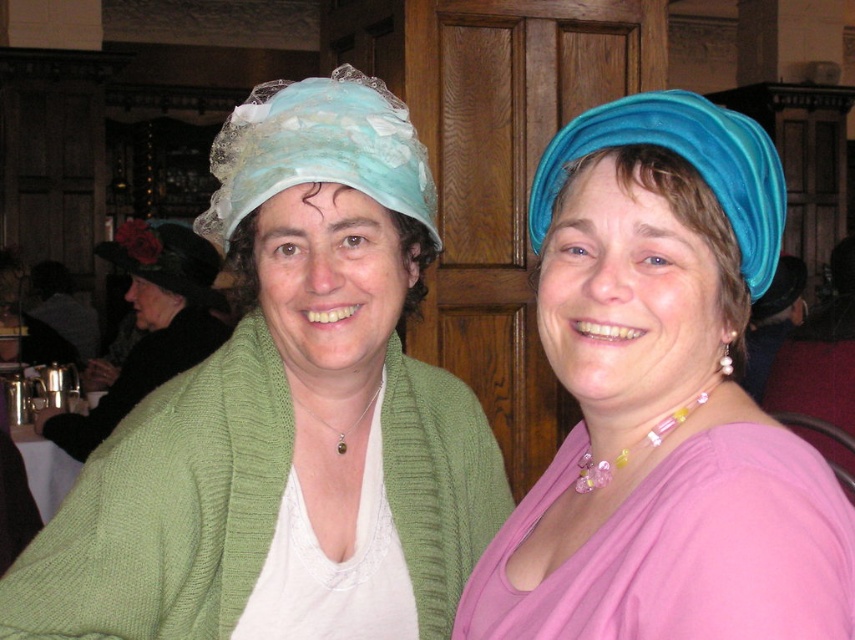
Can you confirm if blue velvet hat at upper right is smaller than blue velvet headscarf at upper right?

No.

Does blue velvet hat at upper right lie in front of blue velvet headscarf at upper right?

That is True.

Is point (800, 525) farther from camera compared to point (758, 256)?

No.

Where is `blue velvet hat at upper right`? blue velvet hat at upper right is located at coordinates (662, 401).

Can you confirm if blue velvet hat at upper right is wider than green knitted robe at center?

No.

Does point (730, 621) come in front of point (422, 417)?

Yes, it is in front of point (422, 417).

Locate an element on the screen. The height and width of the screenshot is (640, 855). blue velvet hat at upper right is located at coordinates (662, 401).

You are a GUI agent. You are given a task and a screenshot of the screen. Output one action in this format:
    pyautogui.click(x=<x>, y=<y>)
    Task: Click on the blue velvet hat at upper right
    The width and height of the screenshot is (855, 640).
    Given the screenshot: What is the action you would take?
    pos(662,401)

Which is in front, point (254, 406) or point (603, 540)?

Point (603, 540) is more forward.

Does green knitted robe at center appear over pink satin robe at center?

Correct, green knitted robe at center is located above pink satin robe at center.

Is point (434, 465) more distant than point (727, 474)?

Yes, point (434, 465) is farther from viewer.

This screenshot has width=855, height=640. I want to click on green knitted robe at center, so click(x=166, y=509).